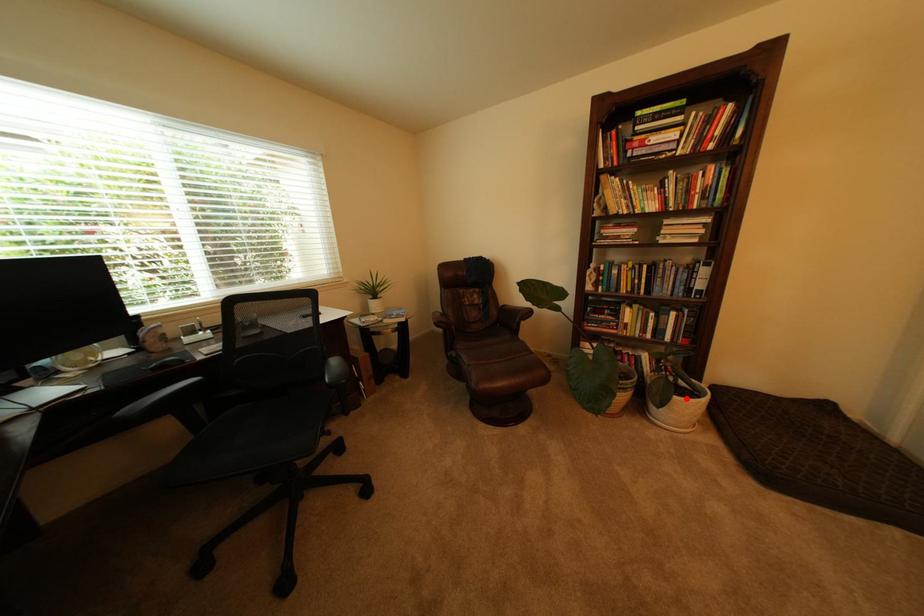
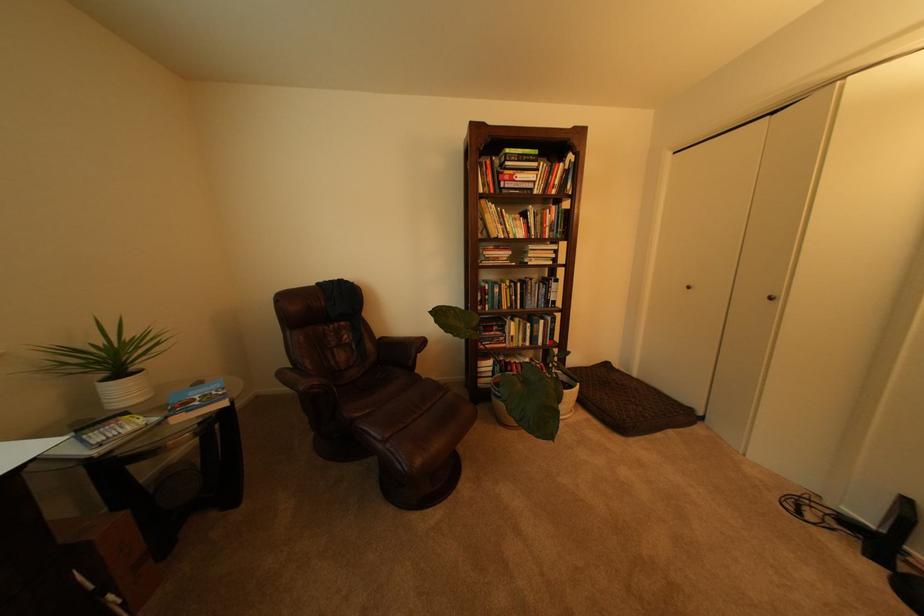
The point at the highlighted location is marked in the first image. Where is the corresponding point in the second image?

(576, 392)